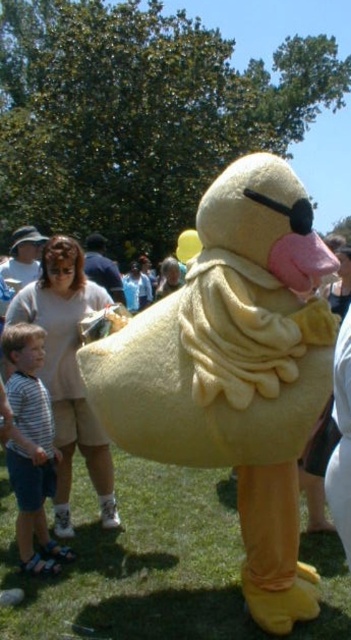
Question: Which point is farther to the camera?

Choices:
 (A) striped fabric shirt at lower left
 (B) yellow plush duck at center

Answer: (A)

Question: Observing the image, what is the correct spatial positioning of yellow plush duck at center in reference to striped fabric shirt at lower left?

Choices:
 (A) right
 (B) left

Answer: (A)

Question: Which point is farther to the camera?

Choices:
 (A) (279, 349)
 (B) (36, 372)

Answer: (B)

Question: Is yellow plush duck at center wider than striped fabric shirt at lower left?

Choices:
 (A) no
 (B) yes

Answer: (B)

Question: Does yellow plush duck at center come in front of striped fabric shirt at lower left?

Choices:
 (A) yes
 (B) no

Answer: (A)